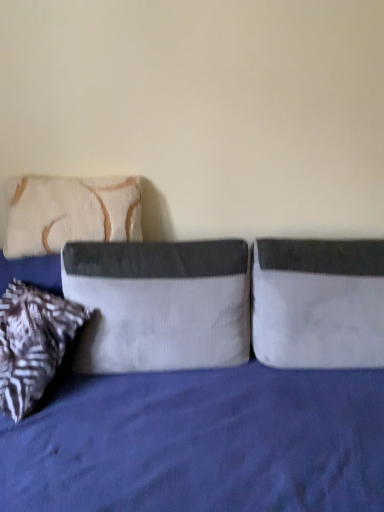
What is the approximate width of velvet blue bed at center?

velvet blue bed at center is 3.55 feet wide.

In order to face velvet gray pillow at center, which appears as the 2th pillow when viewed from the right, should I rotate leftwards or rightwards?

It's best to rotate left around 4.639 degrees.

Locate an element on the screen. white fabric pillow at right, the 3th pillow when ordered from left to right is located at coordinates (318, 303).

Which object is further away from the camera, beige textured pillow at left, the 3th pillow when ordered from right to left, or white fabric pillow at right, the 3th pillow when ordered from left to right?

beige textured pillow at left, the 3th pillow when ordered from right to left, is further away from the camera.

How distant is beige textured pillow at left, placed as the first pillow when sorted from left to right, from white fabric pillow at right, the 3th pillow when ordered from left to right?

beige textured pillow at left, placed as the first pillow when sorted from left to right, is 30.68 inches away from white fabric pillow at right, the 3th pillow when ordered from left to right.

Is point (74, 224) positioned in front of point (305, 330)?

No, it is not.

The image size is (384, 512). In order to click on the 1st pillow in front of the beige textured pillow at left, the 3th pillow when ordered from right to left, starting your count from the anchor in this screenshot , I will do `click(318, 303)`.

Based on their sizes in the image, would you say velvet gray pillow at center, which appears as the 2th pillow when viewed from the right, is bigger or smaller than beige textured pillow at left, placed as the first pillow when sorted from left to right?

Considering their sizes, velvet gray pillow at center, which appears as the 2th pillow when viewed from the right, takes up more space than beige textured pillow at left, placed as the first pillow when sorted from left to right.

From a real-world perspective, which object rests below the other?

From a 3D spatial view, velvet gray pillow at center, which appears as the 2th pillow when viewed from the right, is below.

Looking at this image, relative to beige textured pillow at left, the 3th pillow when ordered from right to left, is velvet gray pillow at center, which appears as the 2th pillow when viewed from the right, in front or behind?

velvet gray pillow at center, which appears as the 2th pillow when viewed from the right, is positioned closer to the viewer than beige textured pillow at left, the 3th pillow when ordered from right to left.

Is velvet gray pillow at center, which appears as the 2th pillow when viewed from the right, oriented towards beige textured pillow at left, the 3th pillow when ordered from right to left?

No, velvet gray pillow at center, which appears as the 2th pillow when viewed from the right, is not facing towards beige textured pillow at left, the 3th pillow when ordered from right to left.

Is beige textured pillow at left, placed as the first pillow when sorted from left to right, in front of or behind velvet blue bed at center in the image?

beige textured pillow at left, placed as the first pillow when sorted from left to right, is positioned farther from the viewer than velvet blue bed at center.

Can you confirm if beige textured pillow at left, the 3th pillow when ordered from right to left, is wider than velvet blue bed at center?

Incorrect, the width of beige textured pillow at left, the 3th pillow when ordered from right to left, does not surpass that of velvet blue bed at center.

Looking at this image, considering the sizes of objects beige textured pillow at left, the 3th pillow when ordered from right to left, and velvet blue bed at center in the image provided, who is smaller, beige textured pillow at left, the 3th pillow when ordered from right to left, or velvet blue bed at center?

beige textured pillow at left, the 3th pillow when ordered from right to left.

Considering the sizes of objects white fabric pillow at right, placed as the first pillow when sorted from right to left, and beige textured pillow at left, the 3th pillow when ordered from right to left, in the image provided, who is wider, white fabric pillow at right, placed as the first pillow when sorted from right to left, or beige textured pillow at left, the 3th pillow when ordered from right to left,?

With larger width is white fabric pillow at right, placed as the first pillow when sorted from right to left.

From the image's perspective, is white fabric pillow at right, placed as the first pillow when sorted from right to left, located above or below beige textured pillow at left, the 3th pillow when ordered from right to left?

Based on their image positions, white fabric pillow at right, placed as the first pillow when sorted from right to left, is located beneath beige textured pillow at left, the 3th pillow when ordered from right to left.

Is point (303, 313) farther from camera compared to point (35, 198)?

No, (303, 313) is closer to viewer.

From a real-world perspective, who is located higher, beige textured pillow at left, placed as the first pillow when sorted from left to right, or velvet gray pillow at center, which ranks as the second pillow in left-to-right order?

beige textured pillow at left, placed as the first pillow when sorted from left to right, is physically above.

Looking at the image, does beige textured pillow at left, the 3th pillow when ordered from right to left, seem bigger or smaller compared to velvet gray pillow at center, which ranks as the second pillow in left-to-right order?

Clearly, beige textured pillow at left, the 3th pillow when ordered from right to left, is smaller in size than velvet gray pillow at center, which ranks as the second pillow in left-to-right order.

Which object is further away from the camera, beige textured pillow at left, placed as the first pillow when sorted from left to right, or velvet gray pillow at center, which ranks as the second pillow in left-to-right order?

beige textured pillow at left, placed as the first pillow when sorted from left to right.

Which is in front, point (60, 199) or point (167, 255)?

Positioned in front is point (167, 255).

Is velvet gray pillow at center, which ranks as the second pillow in left-to-right order, facing towards white fabric pillow at right, the 3th pillow when ordered from left to right?

No, velvet gray pillow at center, which ranks as the second pillow in left-to-right order, does not turn towards white fabric pillow at right, the 3th pillow when ordered from left to right.

Who is taller, velvet gray pillow at center, which ranks as the second pillow in left-to-right order, or white fabric pillow at right, placed as the first pillow when sorted from right to left?

velvet gray pillow at center, which ranks as the second pillow in left-to-right order, is taller.

From the image's perspective, is velvet gray pillow at center, which ranks as the second pillow in left-to-right order, located above or below white fabric pillow at right, the 3th pillow when ordered from left to right?

Based on their image positions, velvet gray pillow at center, which ranks as the second pillow in left-to-right order, is located above white fabric pillow at right, the 3th pillow when ordered from left to right.

Are velvet gray pillow at center, which ranks as the second pillow in left-to-right order, and velvet blue bed at center far apart?

velvet gray pillow at center, which ranks as the second pillow in left-to-right order, is near velvet blue bed at center, not far away.

Looking at this image, is velvet blue bed at center a part of velvet gray pillow at center, which appears as the 2th pillow when viewed from the right?

Definitely not — velvet blue bed at center is not inside velvet gray pillow at center, which appears as the 2th pillow when viewed from the right.

In the scene shown: From the image's perspective, is velvet gray pillow at center, which appears as the 2th pillow when viewed from the right, under velvet blue bed at center?

Actually, velvet gray pillow at center, which appears as the 2th pillow when viewed from the right, appears above velvet blue bed at center in the image.

Where is `pillow behind the white fabric pillow at right, placed as the first pillow when sorted from right to left`? Image resolution: width=384 pixels, height=512 pixels. pillow behind the white fabric pillow at right, placed as the first pillow when sorted from right to left is located at coordinates pos(69,212).

Locate an element on the screen. pillow on the left of velvet gray pillow at center, which appears as the 2th pillow when viewed from the right is located at coordinates (69, 212).

From the image, which object appears to be farther from velvet gray pillow at center, which appears as the 2th pillow when viewed from the right, velvet blue bed at center or beige textured pillow at left, the 3th pillow when ordered from right to left?

beige textured pillow at left, the 3th pillow when ordered from right to left, is positioned further to the anchor velvet gray pillow at center, which appears as the 2th pillow when viewed from the right.

Looking at the image, which one is located closer to velvet blue bed at center, velvet gray pillow at center, which ranks as the second pillow in left-to-right order, or beige textured pillow at left, the 3th pillow when ordered from right to left?

velvet gray pillow at center, which ranks as the second pillow in left-to-right order, is closer to velvet blue bed at center.

Looking at the image, which one is located further to velvet gray pillow at center, which ranks as the second pillow in left-to-right order, beige textured pillow at left, the 3th pillow when ordered from right to left, or white fabric pillow at right, the 3th pillow when ordered from left to right?

Among the two, beige textured pillow at left, the 3th pillow when ordered from right to left, is located further to velvet gray pillow at center, which ranks as the second pillow in left-to-right order.

Looking at the image, which one is located further to white fabric pillow at right, the 3th pillow when ordered from left to right, beige textured pillow at left, placed as the first pillow when sorted from left to right, or velvet gray pillow at center, which appears as the 2th pillow when viewed from the right?

beige textured pillow at left, placed as the first pillow when sorted from left to right, is further to white fabric pillow at right, the 3th pillow when ordered from left to right.

When comparing their distances from white fabric pillow at right, placed as the first pillow when sorted from right to left, does velvet blue bed at center or beige textured pillow at left, placed as the first pillow when sorted from left to right, seem closer?

velvet blue bed at center.

Considering their positions, is velvet gray pillow at center, which appears as the 2th pillow when viewed from the right, positioned closer to velvet blue bed at center than white fabric pillow at right, placed as the first pillow when sorted from right to left?

velvet gray pillow at center, which appears as the 2th pillow when viewed from the right, is positioned closer to the anchor velvet blue bed at center.

When comparing their distances from beige textured pillow at left, placed as the first pillow when sorted from left to right, does velvet blue bed at center or velvet gray pillow at center, which ranks as the second pillow in left-to-right order, seem closer?

A: velvet gray pillow at center, which ranks as the second pillow in left-to-right order, lies closer to beige textured pillow at left, placed as the first pillow when sorted from left to right, than the other object.

Based on their spatial positions, is beige textured pillow at left, the 3th pillow when ordered from right to left, or velvet blue bed at center further from white fabric pillow at right, the 3th pillow when ordered from left to right?

beige textured pillow at left, the 3th pillow when ordered from right to left, is positioned further to the anchor white fabric pillow at right, the 3th pillow when ordered from left to right.

The image size is (384, 512). Find the location of `bed located between velvet gray pillow at center, which appears as the 2th pillow when viewed from the right, and white fabric pillow at right, placed as the first pillow when sorted from right to left, in the left-right direction`. bed located between velvet gray pillow at center, which appears as the 2th pillow when viewed from the right, and white fabric pillow at right, placed as the first pillow when sorted from right to left, in the left-right direction is located at coordinates (201, 443).

Find the location of a particular element. The width and height of the screenshot is (384, 512). bed between beige textured pillow at left, the 3th pillow when ordered from right to left, and white fabric pillow at right, the 3th pillow when ordered from left to right is located at coordinates (201, 443).

The height and width of the screenshot is (512, 384). I want to click on pillow between beige textured pillow at left, the 3th pillow when ordered from right to left, and white fabric pillow at right, the 3th pillow when ordered from left to right, in the horizontal direction, so click(160, 304).